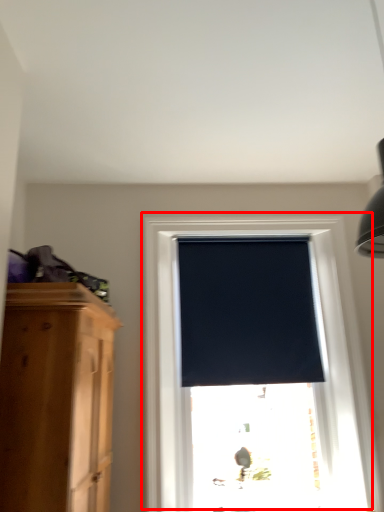
Question: Considering the relative positions of window (annotated by the red box) and window blind in the image provided, where is window (annotated by the red box) located with respect to the staircase?

Choices:
 (A) right
 (B) left

Answer: (A)